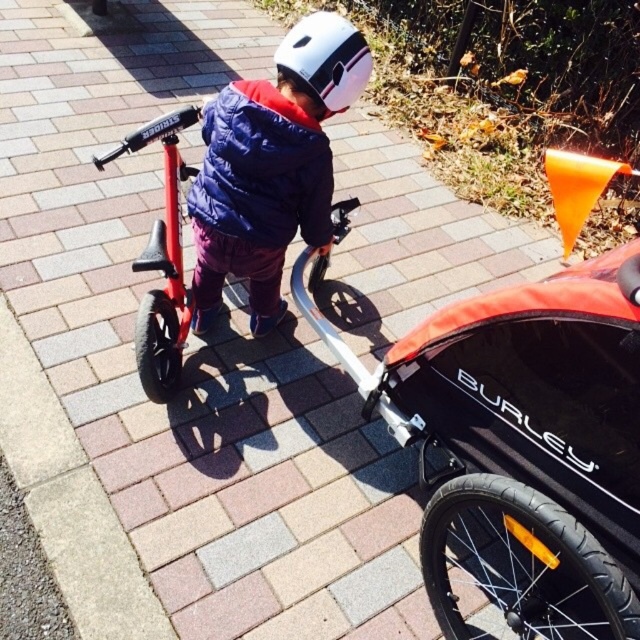
Which is above, shiny red bicycle at center or white matte helmet at upper center?

white matte helmet at upper center is above.

Between point (150, 120) and point (278, 58), which one is positioned in front?

Point (278, 58) is in front.

Where is `shiny red bicycle at center`? shiny red bicycle at center is located at coordinates (163, 260).

Which is behind, point (564, 490) or point (330, 225)?

The point (330, 225) is more distant.

Identify the location of orange fabric baby carriage at center. This screenshot has height=640, width=640. (524, 445).

Is matte blue jacket at center positioned before blue down jacket at center?

Yes, matte blue jacket at center is closer to the viewer.

Can you confirm if matte blue jacket at center is smaller than blue down jacket at center?

Actually, matte blue jacket at center might be larger than blue down jacket at center.

Where is `matte blue jacket at center`? This screenshot has width=640, height=640. matte blue jacket at center is located at coordinates (272, 166).